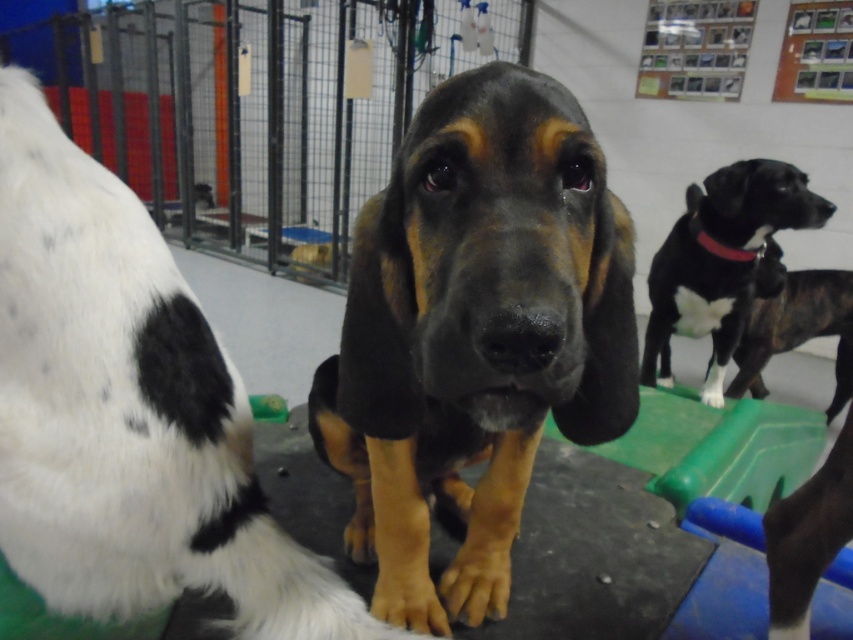
You are a visitor at the animal shelter and want to pet the dogs. You see the black smooth dog at center and the black smooth dog at upper right. Which dog is positioned lower in the image?

The black smooth dog at center is positioned lower in the image than the black smooth dog at upper right.

You are a veterinarian who needs to move a medical cart between the black smooth fur at center and the brindle fur dog at right. The cart is 2 meters wide. Can you safely navigate the space between them without hitting either?

The distance between the black smooth fur at center and the brindle fur dog at right is 2.41 meters. Since the medical cart is 2 meters wide, there is enough space to safely navigate between them without any collisions.

You are a veterinarian who needs to examine the black smooth dog at center. You have a medical kit that requires a minimum of 16 inches of space to open. Can you safely open your kit while standing directly in front of the dog?

The black smooth dog at center is 18.87 inches away from the viewer, which is more than the required 16 inches. Therefore, you can safely open your medical kit while standing directly in front of the dog.